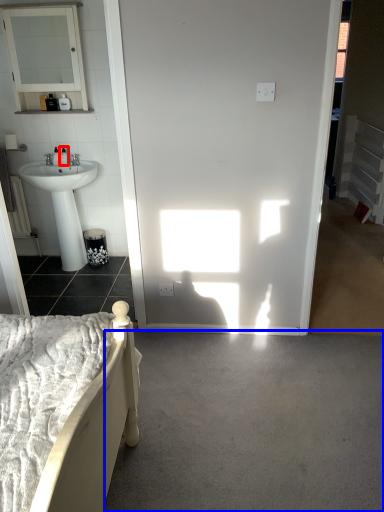
Question: Which object is further to the camera taking this photo, toiletry (highlighted by a red box) or concrete (highlighted by a blue box)?

Choices:
 (A) toiletry
 (B) concrete

Answer: (A)